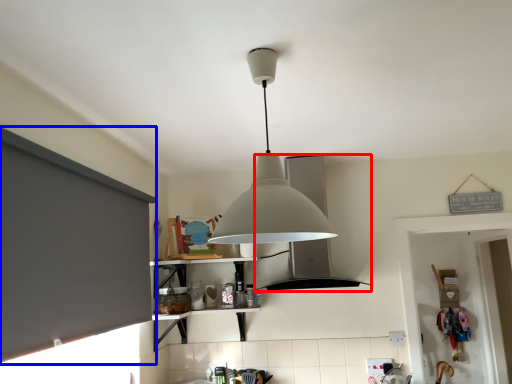
Question: Which object is further to the camera taking this photo, vent (highlighted by a red box) or window screen (highlighted by a blue box)?

Choices:
 (A) vent
 (B) window screen

Answer: (A)